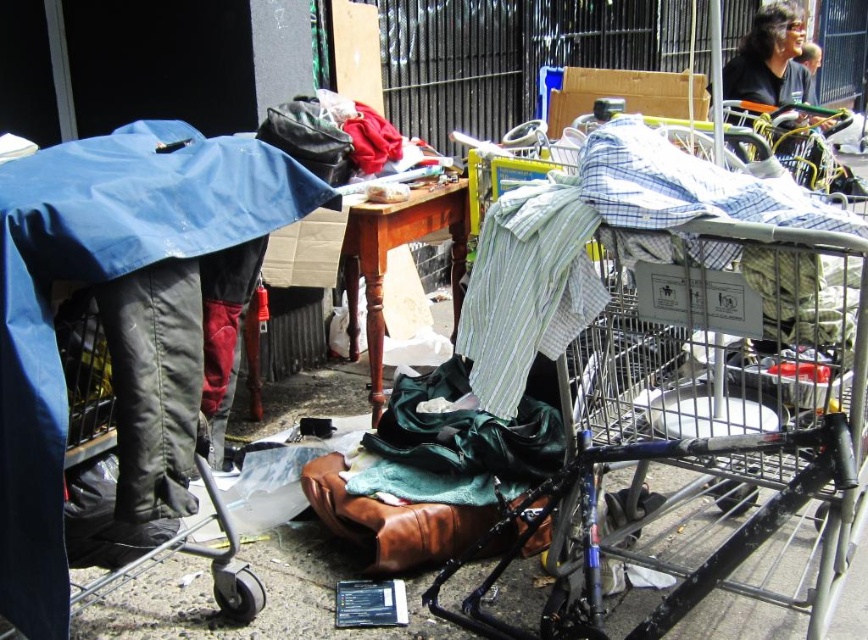
Question: Which of the following is the farthest from the observer?

Choices:
 (A) metallic silver shopping cart at center right
 (B) black shirt at upper right

Answer: (B)

Question: Which object is closer to the camera taking this photo?

Choices:
 (A) metallic silver shopping cart at center right
 (B) black shirt at upper right

Answer: (A)

Question: Is metallic silver shopping cart at center right smaller than black shirt at upper right?

Choices:
 (A) yes
 (B) no

Answer: (B)

Question: Is metallic silver shopping cart at center right above black shirt at upper right?

Choices:
 (A) no
 (B) yes

Answer: (A)

Question: Observing the image, what is the correct spatial positioning of metallic silver shopping cart at center right in reference to black shirt at upper right?

Choices:
 (A) above
 (B) below

Answer: (B)

Question: Which object is farther from the camera taking this photo?

Choices:
 (A) black shirt at upper right
 (B) metallic silver shopping cart at center right

Answer: (A)